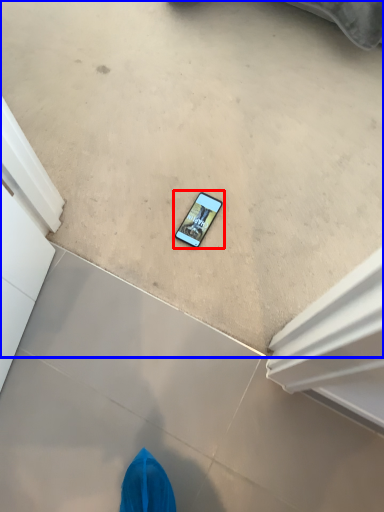
Question: Which of the following is the closest to the observer, mobile phone (highlighted by a red box) or concrete (highlighted by a blue box)?

Choices:
 (A) mobile phone
 (B) concrete

Answer: (B)